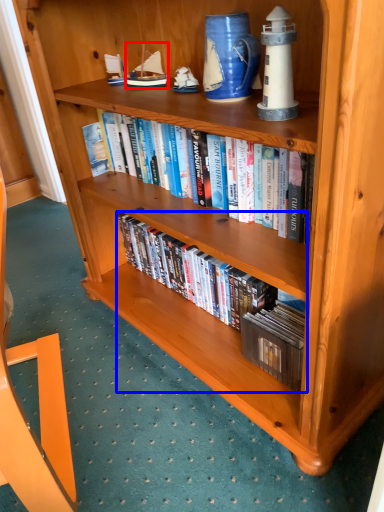
Question: Which object is closer to the camera taking this photo, toy (highlighted by a red box) or book (highlighted by a blue box)?

Choices:
 (A) toy
 (B) book

Answer: (B)